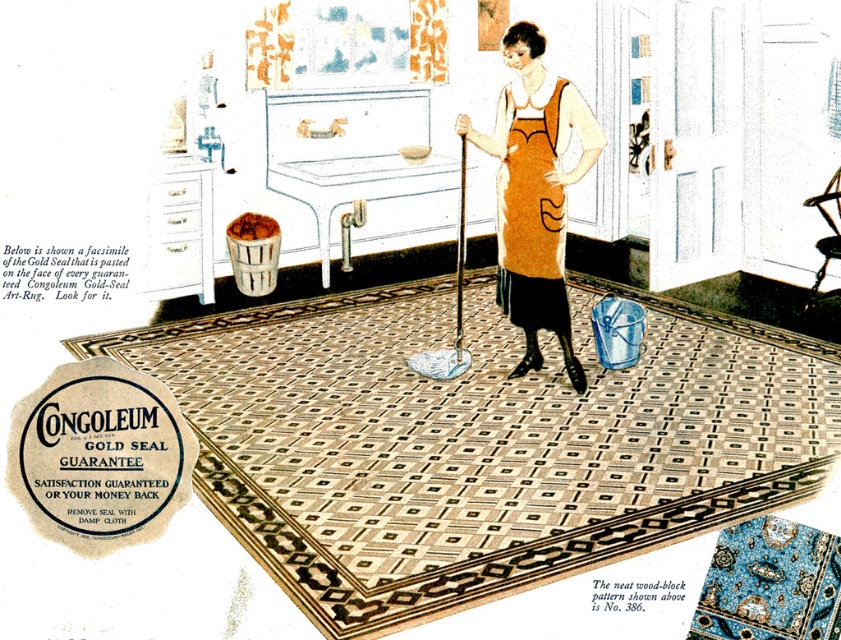
Is point (549, 182) in front of point (538, 275)?

Yes.

How distant is orange fabric dress at center from orange fabric apron at center?

orange fabric dress at center is 1.98 inches from orange fabric apron at center.

Which is behind, point (562, 273) or point (558, 307)?

The point (558, 307) is more distant.

Image resolution: width=841 pixels, height=640 pixels. Identify the location of orange fabric dress at center. (535, 192).